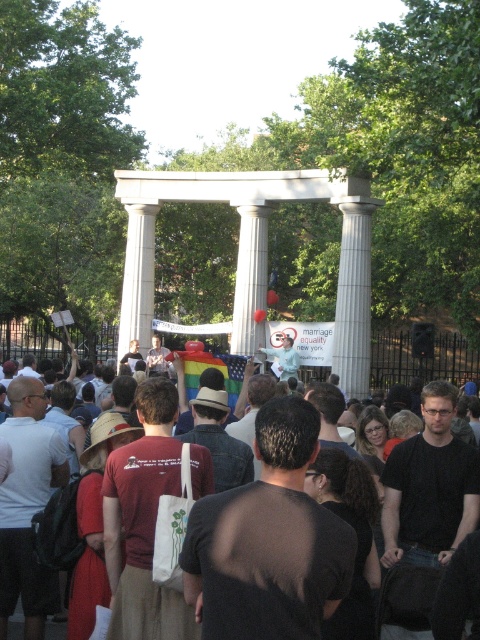
Question: Does white marble column at center appear on the right side of white marble pillar at center?

Choices:
 (A) yes
 (B) no

Answer: (A)

Question: Is white marble column at center smaller than white marble pillar at center?

Choices:
 (A) no
 (B) yes

Answer: (A)

Question: Is the position of white marble column at center less distant than that of white marble pillar at center?

Choices:
 (A) no
 (B) yes

Answer: (B)

Question: Which of the following is the closest to the observer?

Choices:
 (A) (240, 285)
 (B) (158, 342)
 (C) (126, 339)

Answer: (A)

Question: Considering the real-world distances, which object is farthest from the dark brown cotton t-shirt at center?

Choices:
 (A) white marble column at center
 (B) white marble pillar at center

Answer: (B)

Question: Which object is positioned farthest from the white marble column at center?

Choices:
 (A) white marble pillar at center
 (B) dark brown cotton t-shirt at center

Answer: (B)